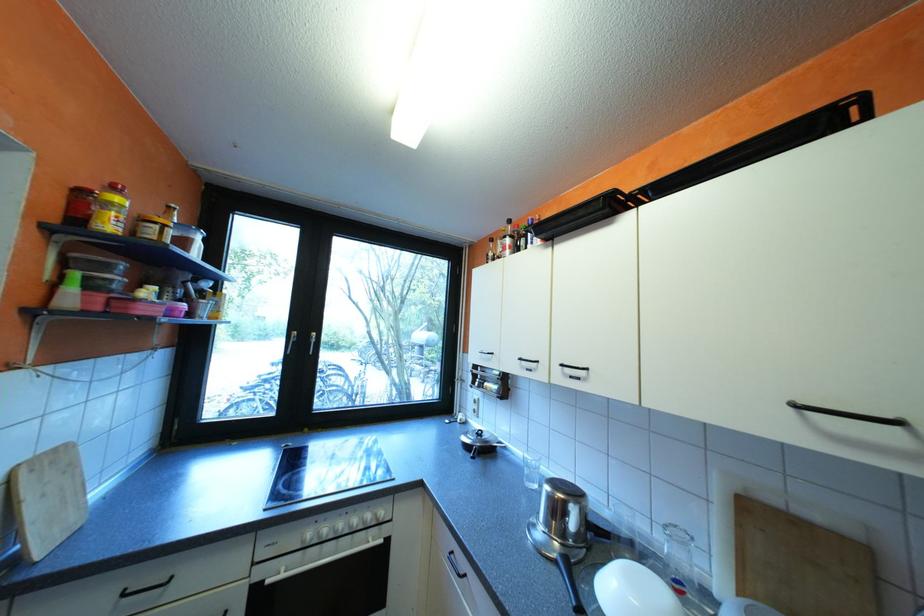
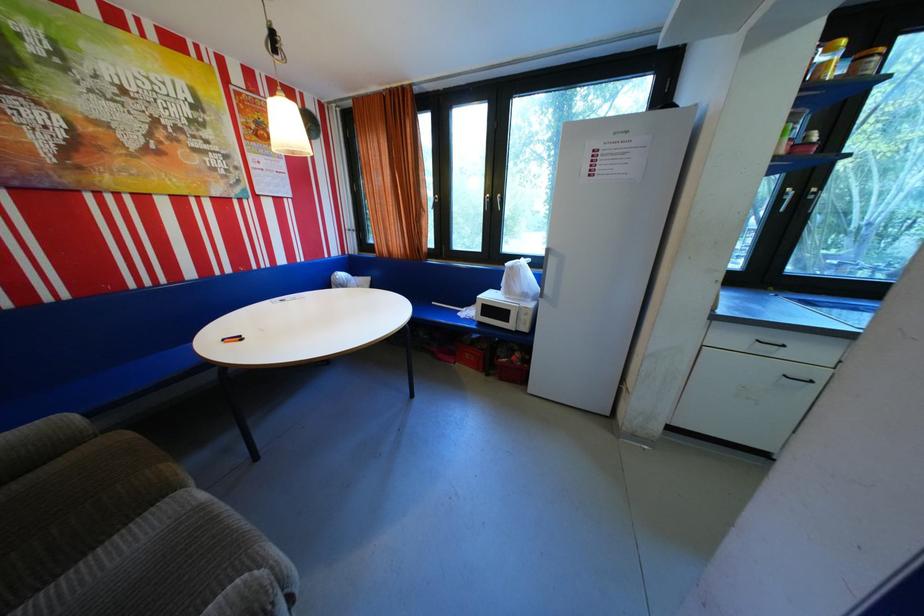
Question: I am providing you with two images of the same scene from different viewpoints. Please identify which objects are invisible in image2.

Choices:
 (A) gray storage box
 (B) wooden cutting board
 (C) blue sofa sitting surface
 (D) white refrigerator handle

Answer: (B)